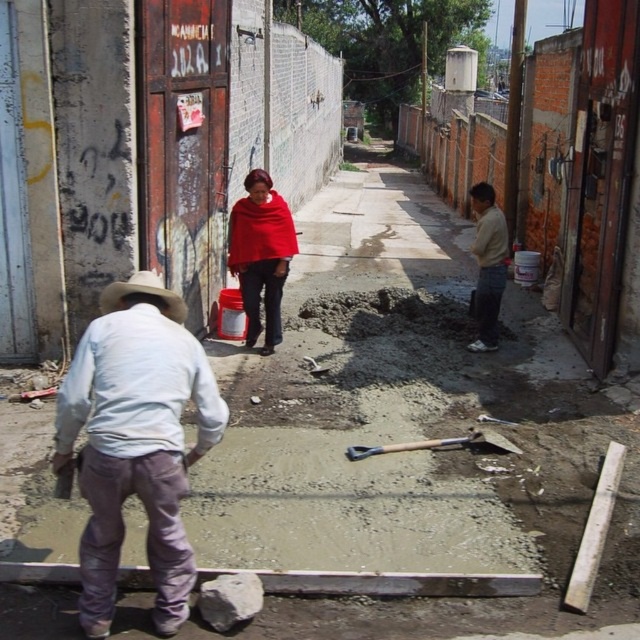
Which is more to the left, red woolen shawl at center or light beige sweater at right?

Positioned to the left is red woolen shawl at center.

Which is behind, point (284, 262) or point (492, 289)?

The point (492, 289) is behind.

The image size is (640, 640). I want to click on red woolen shawl at center, so click(260, 253).

Between red woolen shawl at center and wooden handle shovel at center, which one is positioned lower?

wooden handle shovel at center is below.

Is red woolen shawl at center bigger than wooden handle shovel at center?

Yes, red woolen shawl at center is bigger than wooden handle shovel at center.

Where is `red woolen shawl at center`? red woolen shawl at center is located at coordinates (260, 253).

Can you confirm if light blue cotton shirt at left is positioned to the left of light beige sweater at right?

Correct, you'll find light blue cotton shirt at left to the left of light beige sweater at right.

Can you confirm if light blue cotton shirt at left is bigger than light beige sweater at right?

Indeed, light blue cotton shirt at left has a larger size compared to light beige sweater at right.

You are a GUI agent. You are given a task and a screenshot of the screen. Output one action in this format:
    pyautogui.click(x=<x>, y=<y>)
    Task: Click on the light blue cotton shirt at left
    This screenshot has width=640, height=640.
    Given the screenshot: What is the action you would take?
    pyautogui.click(x=134, y=442)